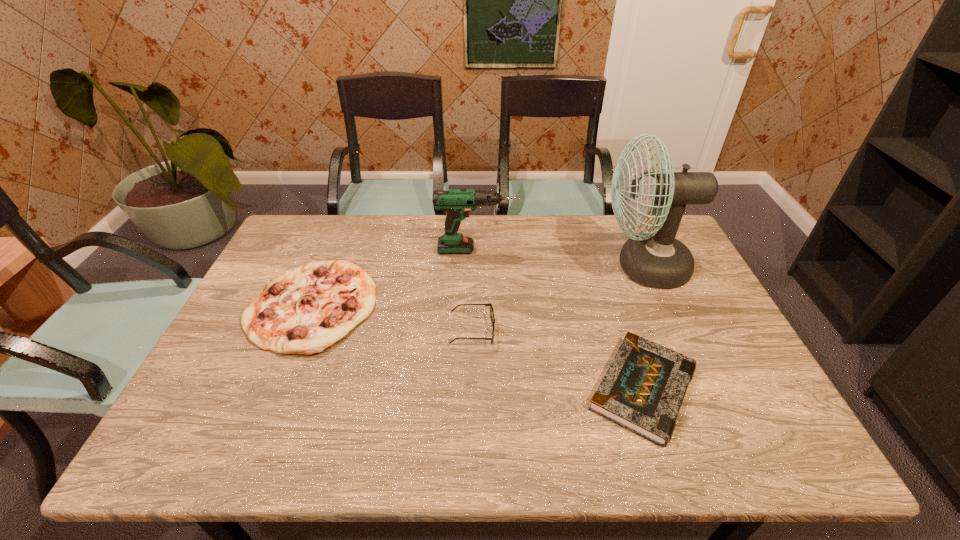
Locate an element on the screen. empty space that is in between the tallest object and the spectacles is located at coordinates [x=558, y=299].

Where is `free spot between the leftmost object and the second tallest object`? This screenshot has width=960, height=540. free spot between the leftmost object and the second tallest object is located at coordinates (394, 278).

I want to click on free point between the pizza and the fan, so click(477, 287).

Image resolution: width=960 pixels, height=540 pixels. I want to click on vacant region between the pizza and the spectacles, so click(x=392, y=319).

Point out which object is positioned as the second nearest to the fan. Please provide its 2D coordinates. Your answer should be formatted as a tuple, i.e. [(x, y)], where the tuple contains the x and y coordinates of a point satisfying the conditions above.

[(457, 203)]

Image resolution: width=960 pixels, height=540 pixels. Identify the location of object that stands as the second closest to the leftmost object. (491, 307).

Find the location of a particular element. Image resolution: width=960 pixels, height=540 pixels. vacant space that satisfies the following two spatial constraints: 1. in front of the tallest object where the airflow is directed; 2. on the front side of the leftmost object is located at coordinates (660, 306).

At what (x,y) coordinates should I click in order to perform the action: click on vacant space that satisfies the following two spatial constraints: 1. on the front-facing side of the spectacles; 2. on the left side of the notebook. Please return your answer as a coordinate pair (x, y). Image resolution: width=960 pixels, height=540 pixels. Looking at the image, I should click on (471, 389).

Locate an element on the screen. The image size is (960, 540). free space in the image that satisfies the following two spatial constraints: 1. on the front-facing side of the notebook; 2. on the right side of the spectacles is located at coordinates (471, 389).

You are a GUI agent. You are given a task and a screenshot of the screen. Output one action in this format:
    pyautogui.click(x=<x>, y=<y>)
    Task: Click on the free point that satisfies the following two spatial constraints: 1. on the front side of the leftmost object; 2. on the right side of the notebook
    This screenshot has height=540, width=960.
    Given the screenshot: What is the action you would take?
    pyautogui.click(x=277, y=389)